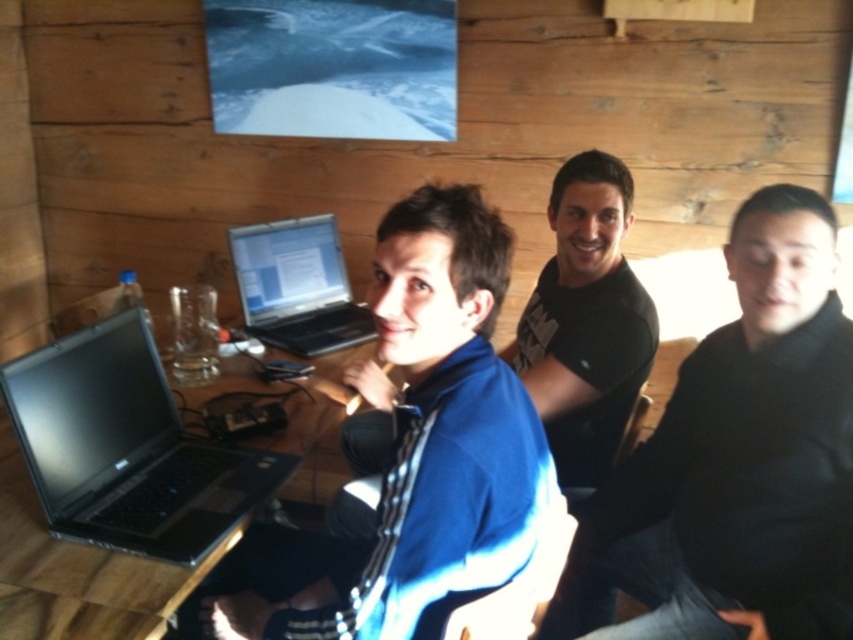
Can you confirm if black matte laptop at left is wider than silver metallic laptop at center?

Correct, the width of black matte laptop at left exceeds that of silver metallic laptop at center.

Can you confirm if black matte laptop at left is thinner than silver metallic laptop at center?

No.

Which is in front, point (112, 364) or point (242, 262)?

Positioned in front is point (112, 364).

Locate an element on the screen. black matte laptop at left is located at coordinates (126, 448).

Is black matte shirt at right thinner than black matte laptop at left?

Indeed, black matte shirt at right has a lesser width compared to black matte laptop at left.

Between black matte shirt at right and black matte laptop at left, which one appears on the right side from the viewer's perspective?

black matte shirt at right is more to the right.

This screenshot has height=640, width=853. Describe the element at coordinates (738, 458) in the screenshot. I see `black matte shirt at right` at that location.

What are the coordinates of `black matte shirt at right` in the screenshot? It's located at (738, 458).

Can you confirm if black matte shirt at right is positioned below blue fleece jacket at center?

Indeed, black matte shirt at right is positioned under blue fleece jacket at center.

Between black matte shirt at right and blue fleece jacket at center, which one appears on the right side from the viewer's perspective?

Positioned to the right is black matte shirt at right.

Measure the distance between point (764, 556) and camera.

They are 1.22 meters apart.

This screenshot has width=853, height=640. What are the coordinates of `black matte shirt at right` in the screenshot? It's located at (738, 458).